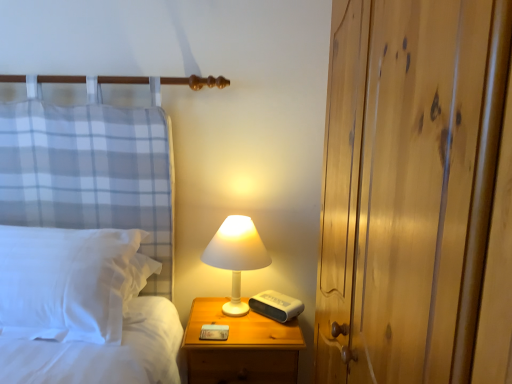
Question: Do you think white soft pillow at left is within wooden dresser at right, or outside of it?

Choices:
 (A) outside
 (B) inside

Answer: (A)

Question: Is white soft pillow at left in front of or behind wooden dresser at right in the image?

Choices:
 (A) behind
 (B) front

Answer: (A)

Question: Which of these objects is positioned closest to the wooden dresser at right?

Choices:
 (A) white matte lamp at center
 (B) white soft pillow at left
 (C) wooden nightstand at lower right

Answer: (C)

Question: Considering the real-world distances, which object is closest to the white soft pillow at left?

Choices:
 (A) wooden dresser at right
 (B) wooden nightstand at lower right
 (C) white matte lamp at center

Answer: (B)